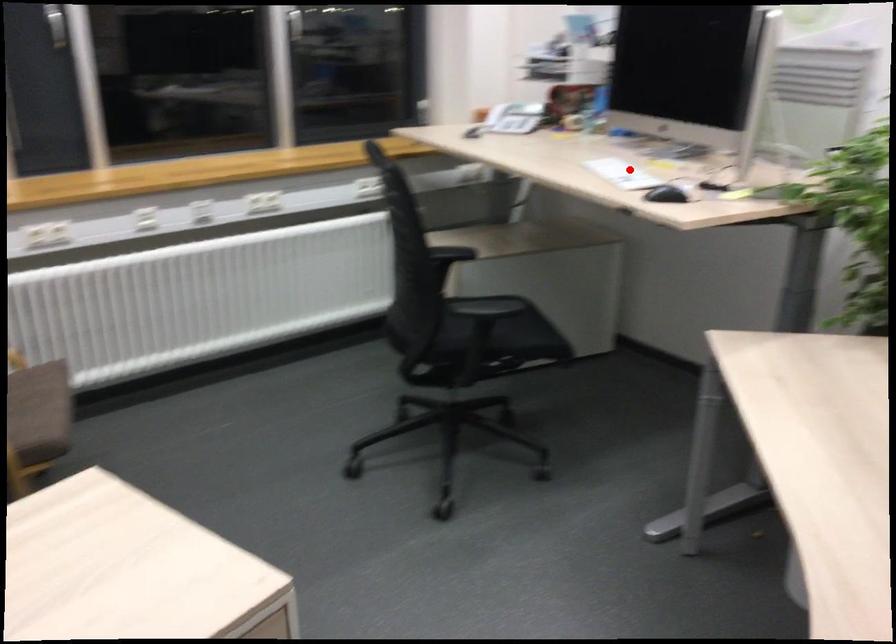
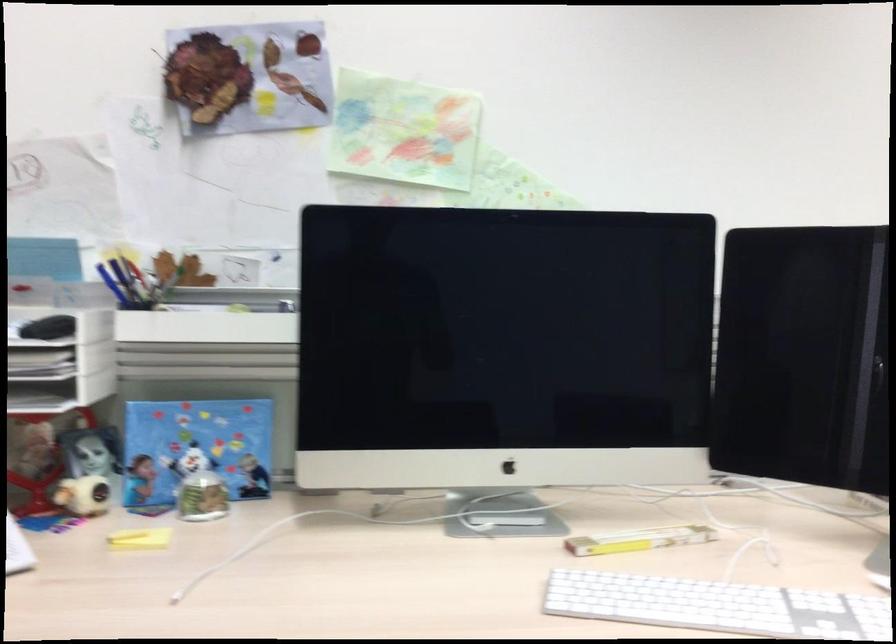
Question: I am providing you with two images of the same scene from different viewpoints. A red point is shown in image1. For the corresponding object point in image2, is it positioned nearer or farther from the camera?

Choices:
 (A) Nearer
 (B) Farther

Answer: (A)